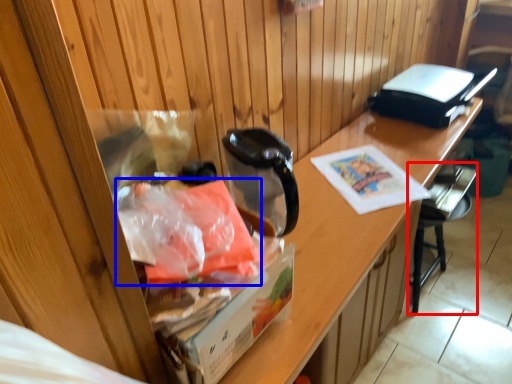
Question: Which point is closer to the camera, chair (highlighted by a red box) or material (highlighted by a blue box)?

Choices:
 (A) chair
 (B) material

Answer: (B)